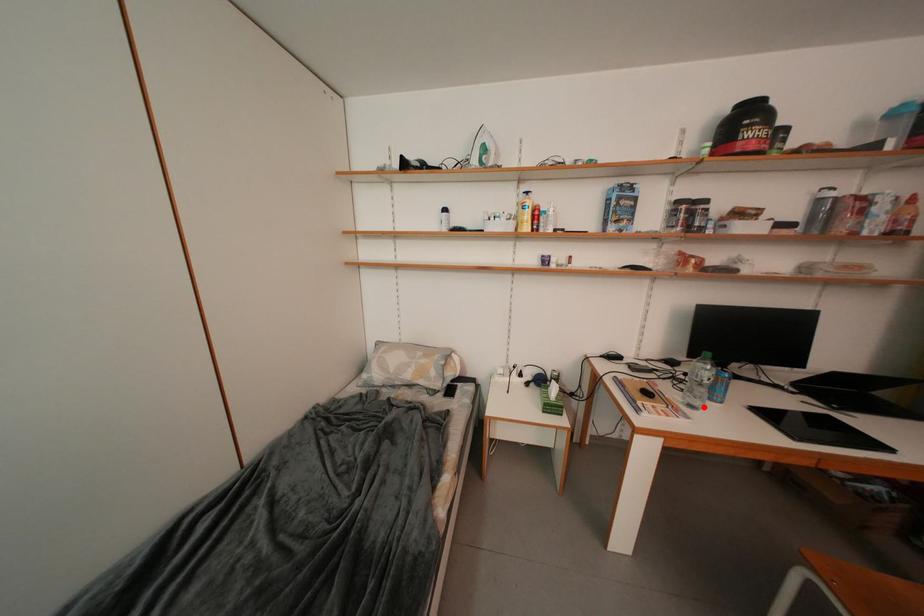
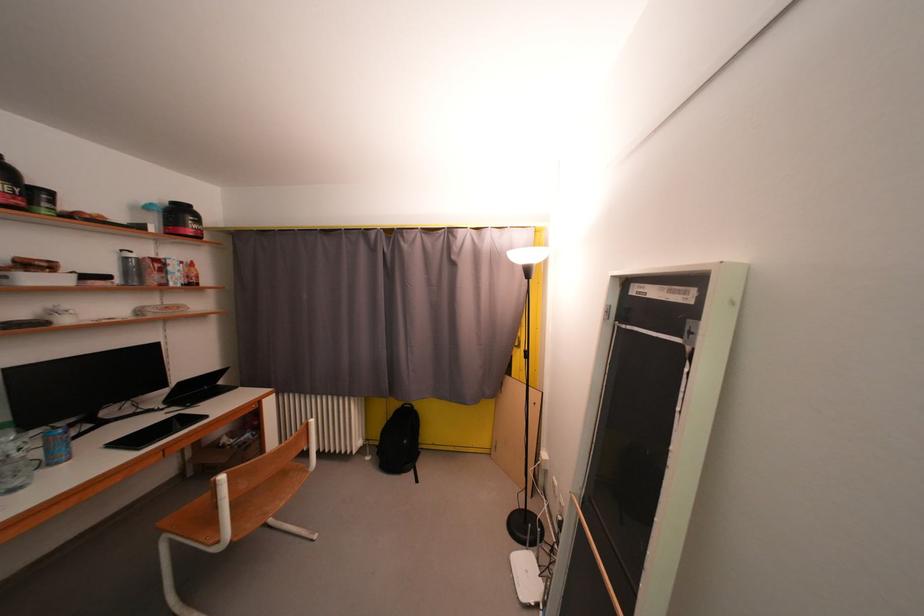
Locate, in the second image, the point that corresponds to the highlighted location in the first image.

(25, 487)